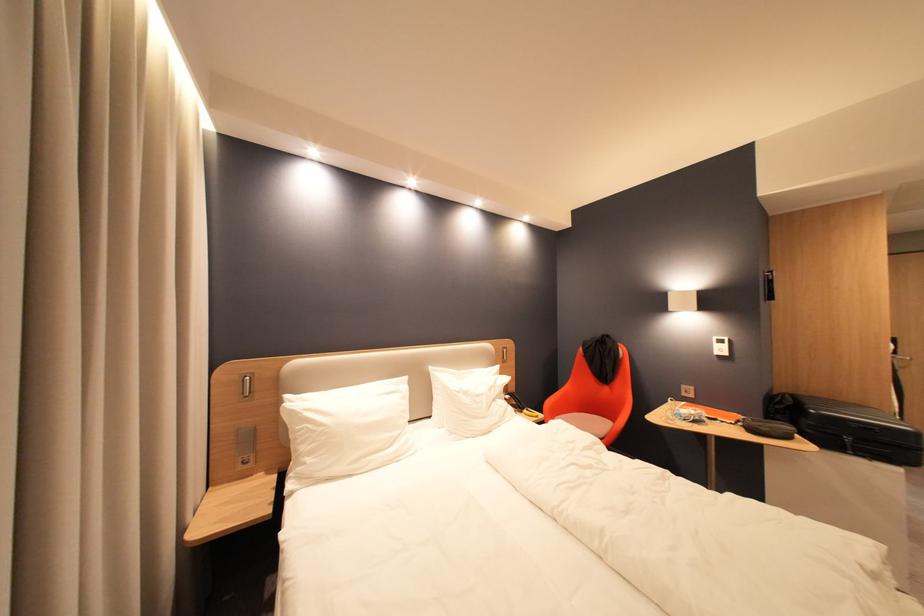
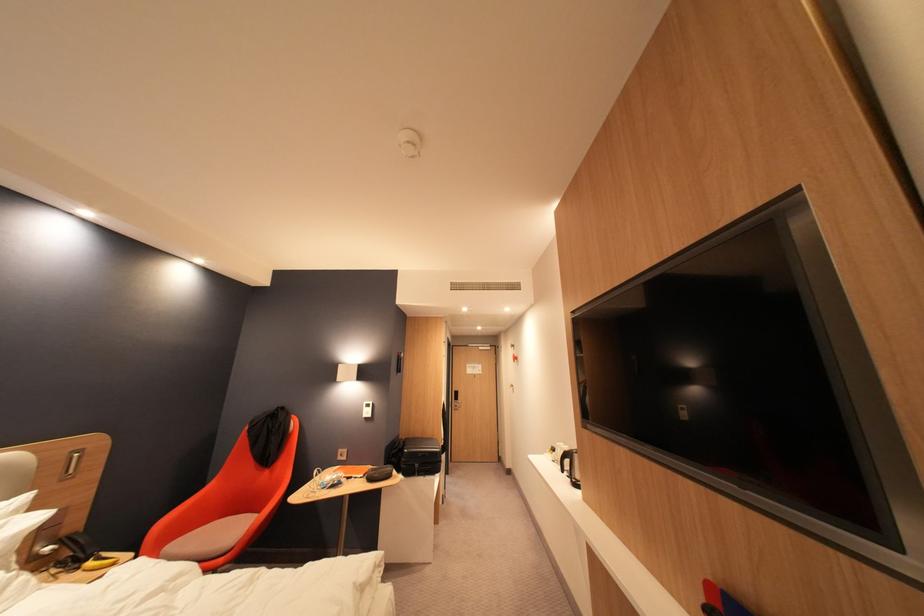
Find the pixel in the second image that matches point (740, 424) in the first image.

(371, 477)